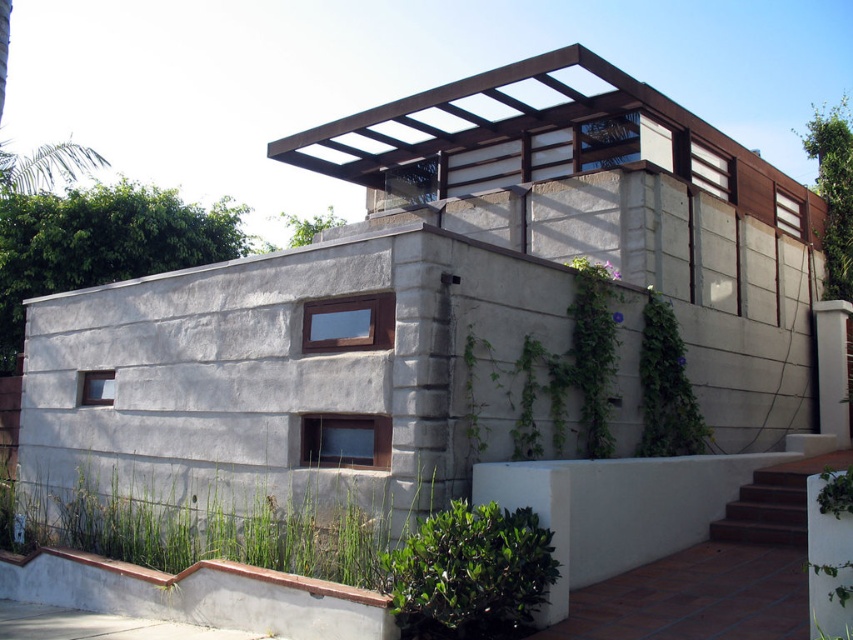
Question: Does brown wood pergola at upper center have a smaller size compared to green leafy ivy at center?

Choices:
 (A) yes
 (B) no

Answer: (B)

Question: Which object is positioned closest to the green leafy plant at center?

Choices:
 (A) green leafy bush at lower center
 (B) green leafy vine at upper right
 (C) green leafy plant at upper right
 (D) brown concrete stairs at lower right

Answer: (B)

Question: Which of the following is the closest to the observer?

Choices:
 (A) green leafy bush at lower center
 (B) green leafy plant at center
 (C) brown concrete stairs at lower right
 (D) green leafy plant at lower left

Answer: (A)

Question: Can you confirm if green leafy ivy at center is smaller than green leafy bush at lower center?

Choices:
 (A) no
 (B) yes

Answer: (A)

Question: Does green leafy ivy at center appear over green leafy vine at upper right?

Choices:
 (A) yes
 (B) no

Answer: (B)

Question: Which point appears closest to the camera in this image?

Choices:
 (A) (788, 522)
 (B) (828, 497)
 (C) (495, 506)
 (D) (729, 200)

Answer: (B)